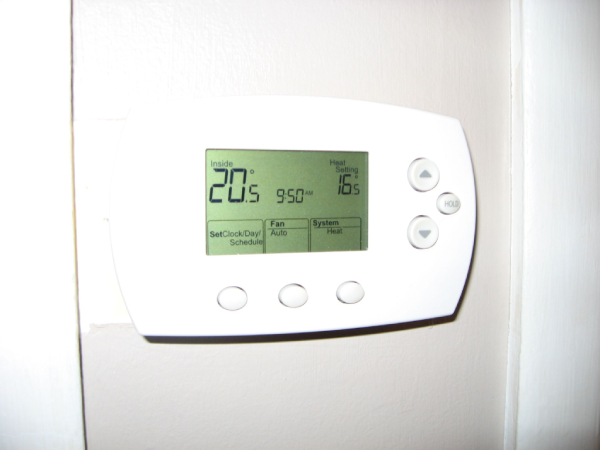
The height and width of the screenshot is (450, 600). In order to click on plastic cover in this screenshot , I will do `click(412, 274)`.